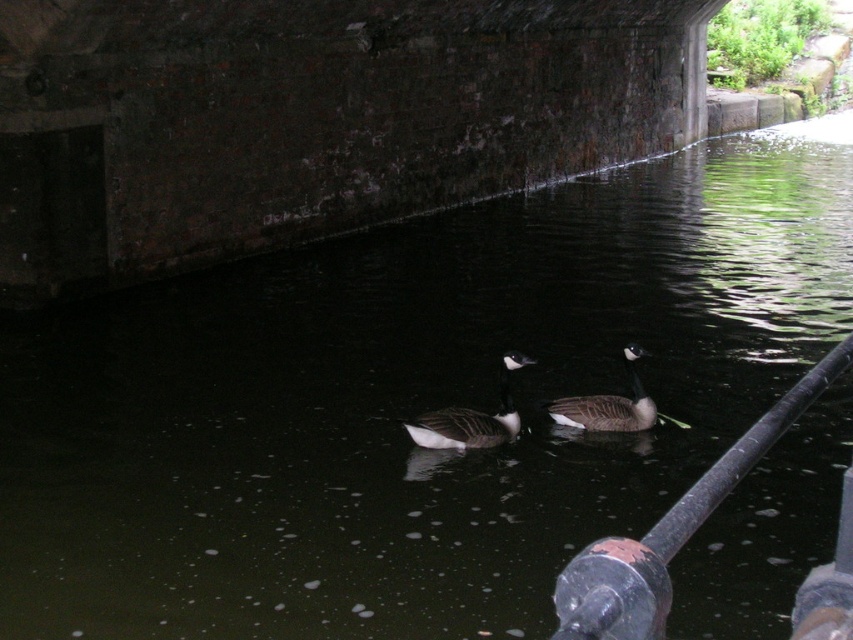
You are a photographer trying to capture a clear shot of the white matte duck at center and the black metal rail at lower right. Since you want both subjects to be in focus, you need to know their heights. Which one is taller?

The white matte duck at center is taller than the black metal rail at lower right.

You are a photographer aiming to capture both the white matte duck at center and the dark gray matte duck at center in a single shot. Given their widths, which duck will occupy more space in the photo?

The white matte duck at center will occupy more space in the photo because its width surpasses that of the dark gray matte duck at center.